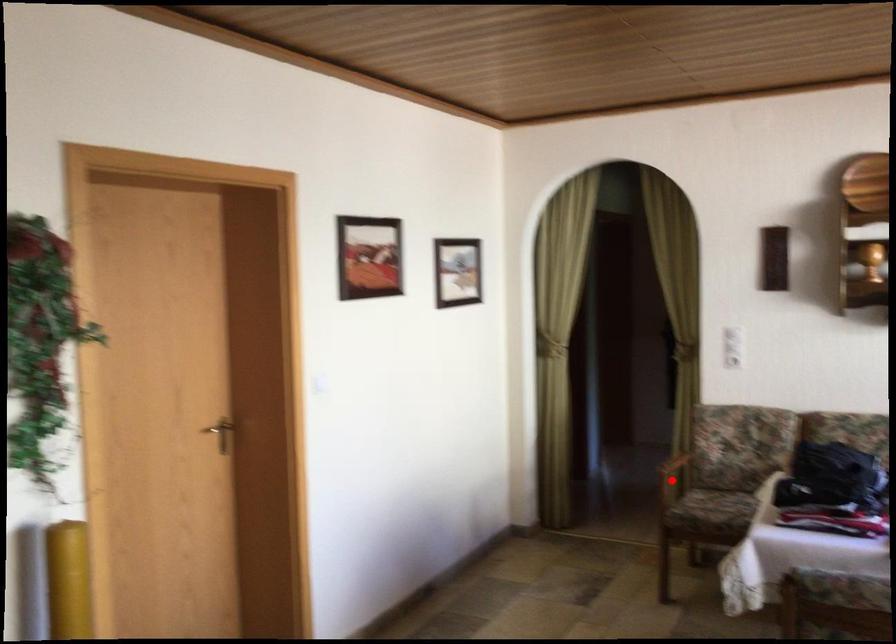
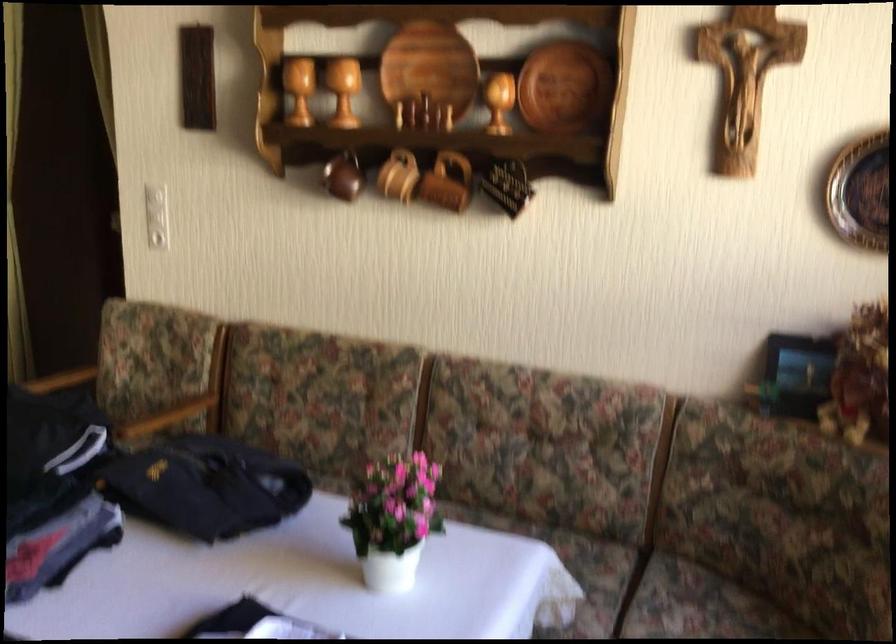
Question: I am providing you with two images of the same scene from different viewpoints. A red point is marked on the first image. Can you still see the location of the red point in image 2?

Choices:
 (A) Yes
 (B) No

Answer: (B)